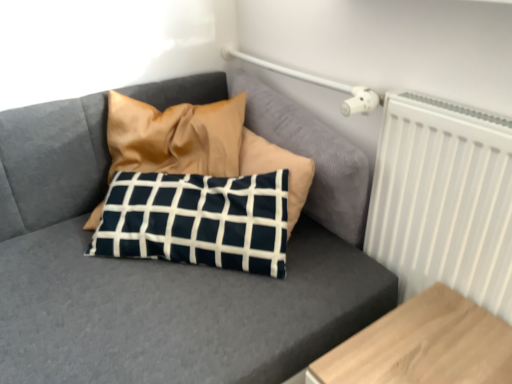
This screenshot has width=512, height=384. Find the location of `free space above light brown wood table at lower right (from a real-world perspective)`. free space above light brown wood table at lower right (from a real-world perspective) is located at coordinates (x=431, y=342).